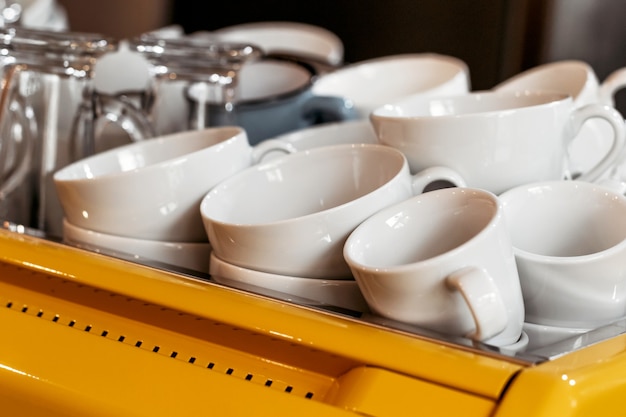
You are a GUI agent. You are given a task and a screenshot of the screen. Output one action in this format:
    pyautogui.click(x=<x>, y=<y>)
    Task: Click on the mugs
    This screenshot has width=626, height=417.
    Given the screenshot: What is the action you would take?
    pyautogui.click(x=457, y=264), pyautogui.click(x=583, y=261), pyautogui.click(x=529, y=147), pyautogui.click(x=571, y=75), pyautogui.click(x=165, y=160), pyautogui.click(x=287, y=216), pyautogui.click(x=404, y=85), pyautogui.click(x=239, y=269), pyautogui.click(x=166, y=244)